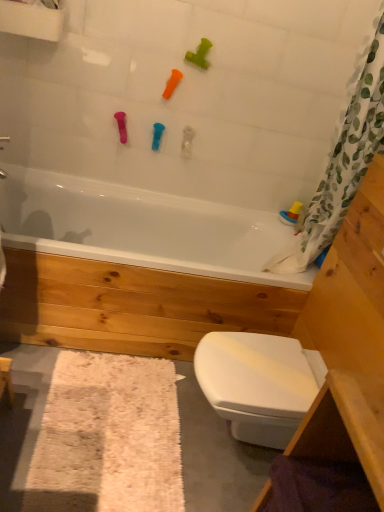
Question: Considering the positions of point (231, 388) and point (299, 210), is point (231, 388) closer or farther from the camera than point (299, 210)?

Choices:
 (A) farther
 (B) closer

Answer: (B)

Question: Considering their positions, is white glossy bidet at lower right located in front of or behind translucent plastic boat at right, the 1th toy in the back-to-front sequence?

Choices:
 (A) behind
 (B) front

Answer: (B)

Question: Which object is positioned farthest from the blue rubber toy at upper center, marked as the second toy in a bottom-to-top arrangement?

Choices:
 (A) white shaggy bath mat at lower left
 (B) white glossy bathtub at center
 (C) translucent plastic boat at right, marked as the first toy in a bottom-to-top arrangement
 (D) white glossy bidet at lower right
 (E) orange rubber toy at upper center, the 2th toy positioned from the left

Answer: (A)

Question: Which is nearer to the white glossy bathtub at center?

Choices:
 (A) blue rubber toy at upper center, placed as the second toy when sorted from back to front
 (B) green rubber toy at upper center, the third toy when ordered from left to right
 (C) translucent plastic boat at right, the first toy in the right-to-left sequence
 (D) white shaggy bath mat at lower left
 (E) white glossy bidet at lower right

Answer: (A)